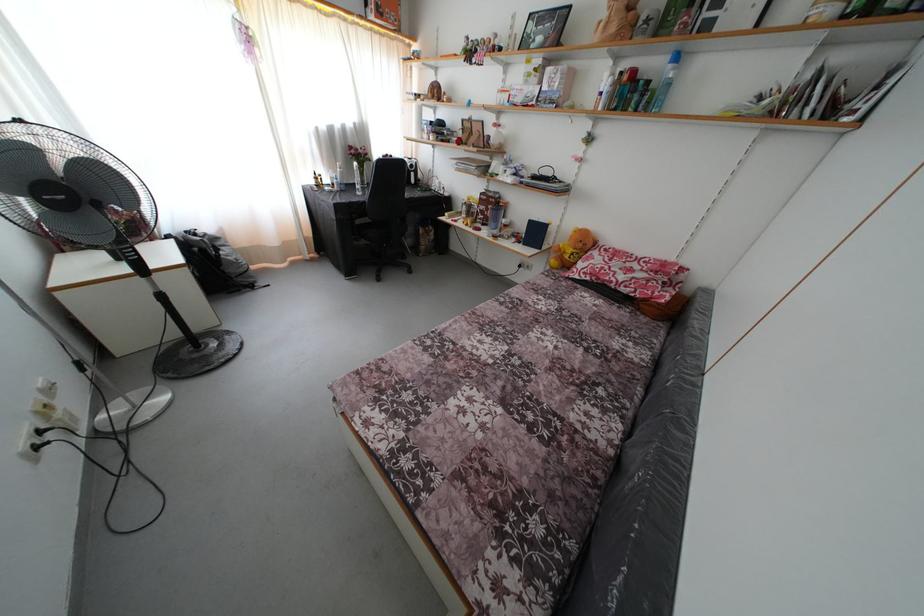
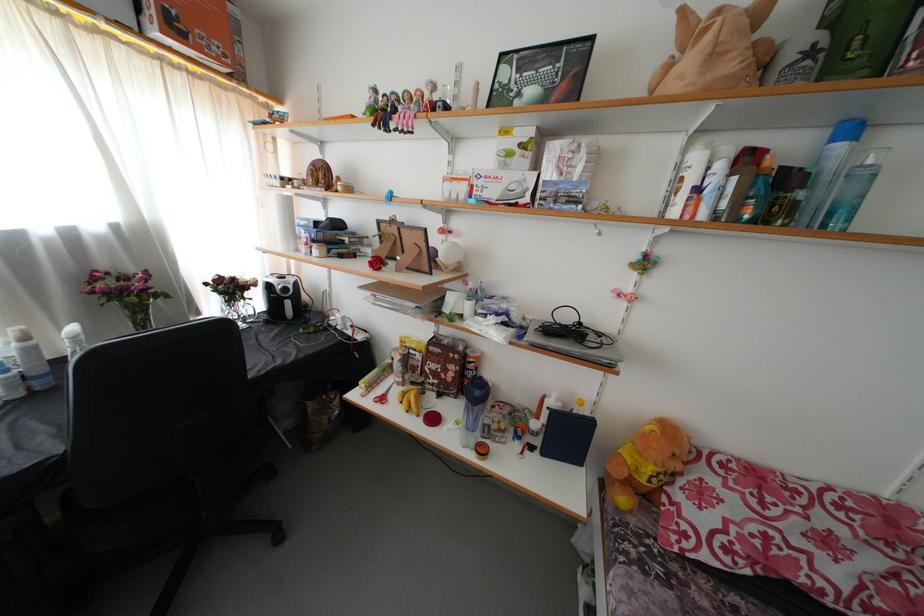
Question: The images are taken continuously from a first-person perspective. In which direction are you moving?

Choices:
 (A) Left
 (B) Right
 (C) Forward
 (D) Backward

Answer: (C)